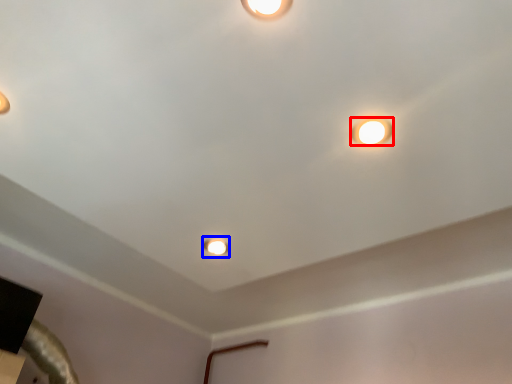
Question: Which point is closer to the camera, lamp (highlighted by a red box) or stage light (highlighted by a blue box)?

Choices:
 (A) lamp
 (B) stage light

Answer: (A)